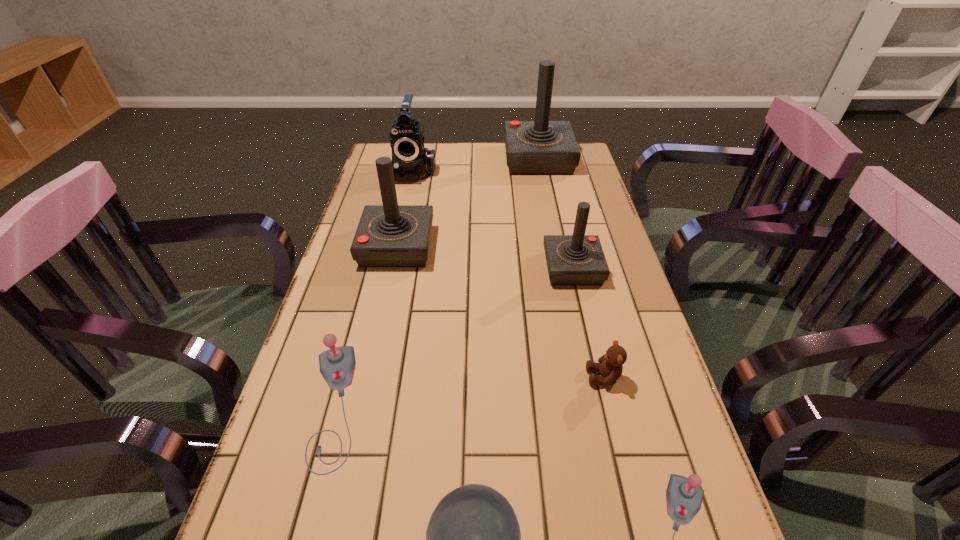
This screenshot has height=540, width=960. What are the coordinates of `red joystick that is the second closest to the third shortest joystick` in the screenshot? It's located at (541, 147).

Choose which red joystick is the second nearest neighbor to the shortest object. Please provide its 2D coordinates. Your answer should be formatted as a tuple, i.e. [(x, y)], where the tuple contains the x and y coordinates of a point satisfying the conditions above.

[(390, 235)]